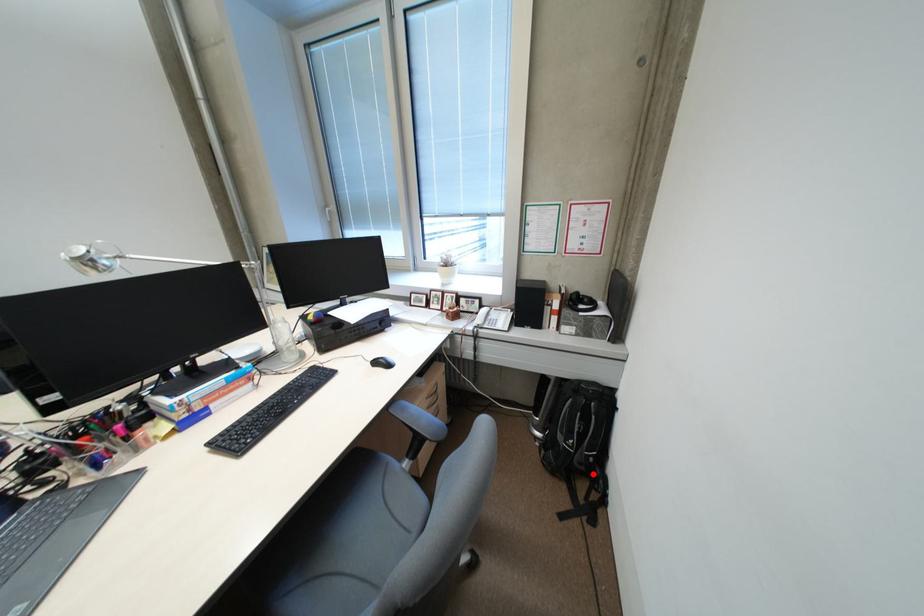
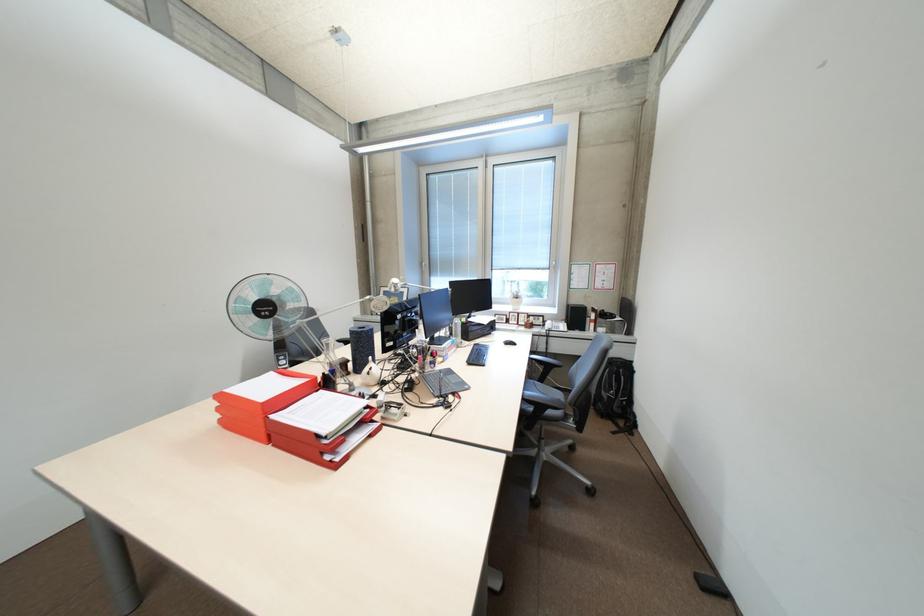
In the second image, find the point that corresponds to the highlighted location in the first image.

(630, 416)